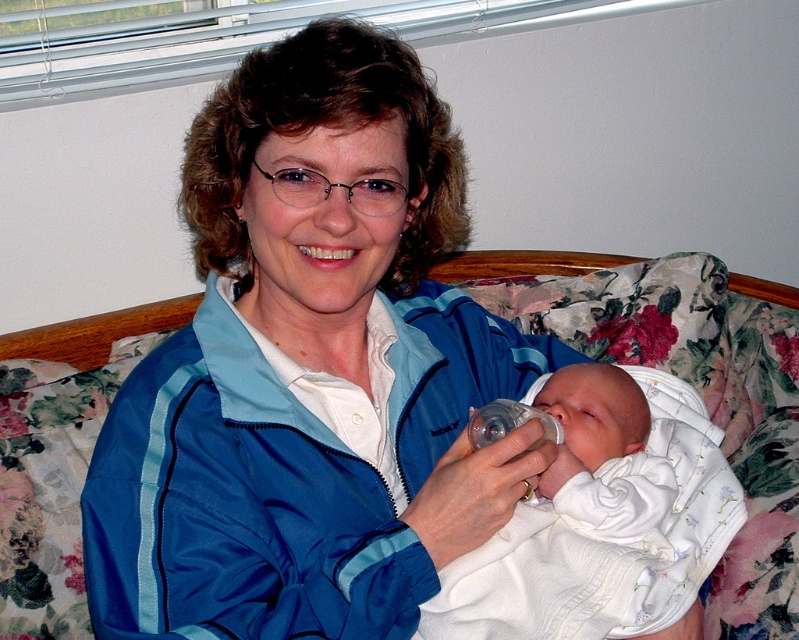
Looking at this image, who is shorter, blue nylon jacket at center or white soft cloth at center?

With less height is white soft cloth at center.

Does point (138, 592) come farther from viewer compared to point (602, 586)?

No, (138, 592) is closer to viewer.

You are a GUI agent. You are given a task and a screenshot of the screen. Output one action in this format:
    pyautogui.click(x=<x>, y=<y>)
    Task: Click on the blue nylon jacket at center
    The width and height of the screenshot is (799, 640).
    Given the screenshot: What is the action you would take?
    pyautogui.click(x=231, y=506)